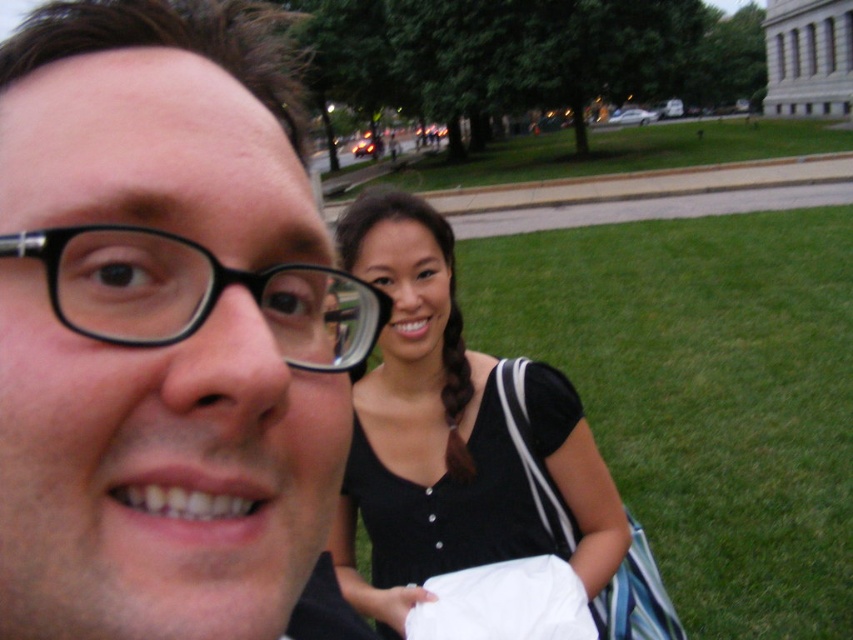
Question: Among these points, which one is farthest from the camera?

Choices:
 (A) (151, 465)
 (B) (744, 493)
 (C) (189, 280)

Answer: (B)

Question: Which point is farther from the camera taking this photo?

Choices:
 (A) (570, 172)
 (B) (132, 305)

Answer: (A)

Question: Is black matte dress at center to the left of green grass at center from the viewer's perspective?

Choices:
 (A) no
 (B) yes

Answer: (B)

Question: Does black matte dress at center have a lesser width compared to black plastic glasses at center?

Choices:
 (A) yes
 (B) no

Answer: (B)

Question: Is green grass at lower right behind black plastic glasses at center?

Choices:
 (A) yes
 (B) no

Answer: (A)

Question: Estimate the real-world distances between objects in this image. Which object is closer to the black plastic glasses at center?

Choices:
 (A) black matte glasses at upper left
 (B) black matte dress at center
 (C) green grass at center
 (D) green grass at lower right

Answer: (A)